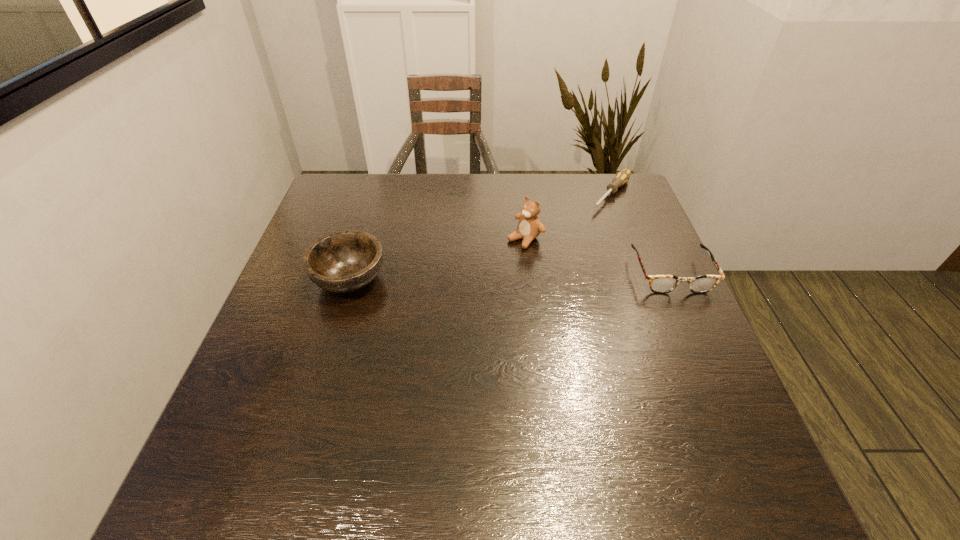
Identify the location of empty location between the farthest object and the leftmost object. (481, 237).

Where is `vacant area between the second tallest object and the spectacles`? The width and height of the screenshot is (960, 540). vacant area between the second tallest object and the spectacles is located at coordinates (510, 276).

The height and width of the screenshot is (540, 960). Find the location of `free space between the leftmost object and the teddy bear`. free space between the leftmost object and the teddy bear is located at coordinates (438, 259).

The width and height of the screenshot is (960, 540). In order to click on free spot between the second shortest object and the leftmost object in this screenshot , I will do `click(510, 276)`.

This screenshot has width=960, height=540. In order to click on vacant space that's between the spectacles and the farthest object in this screenshot , I will do `click(641, 234)`.

Locate an element on the screen. unoccupied area between the second object from left to right and the screwdriver is located at coordinates (568, 217).

This screenshot has height=540, width=960. What are the coordinates of `free point between the farthest object and the tallest object` in the screenshot? It's located at (568, 217).

Identify the location of object that is the second closest to the second farthest object. The height and width of the screenshot is (540, 960). (660, 284).

The height and width of the screenshot is (540, 960). What are the coordinates of `object that is the second closest to the third shortest object` in the screenshot? It's located at (622, 177).